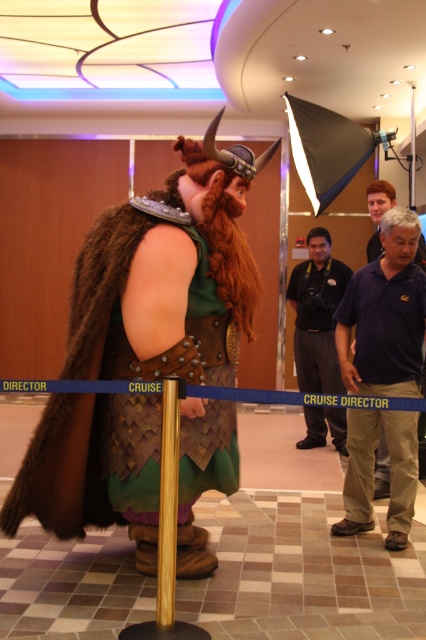
You are a guest at the cruise ship and want to find the staff member in the dark gray uniform at center. You see the blue cotton polo shirt at center. Which direction should you look to find the staff member?

The blue cotton polo shirt at center is to the left of dark gray uniform at center, so you should look to your right to find the staff member in the dark gray uniform at center.